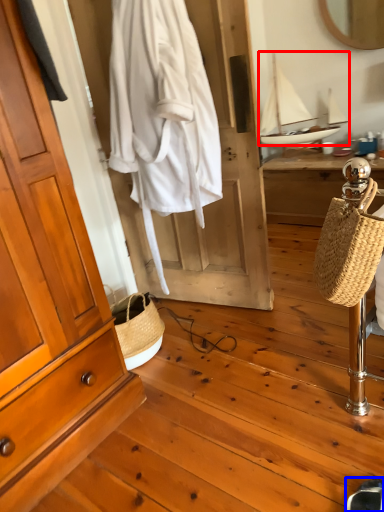
Question: Among these objects, which one is farthest to the camera, sailboat (highlighted by a red box) or shoe (highlighted by a blue box)?

Choices:
 (A) sailboat
 (B) shoe

Answer: (A)